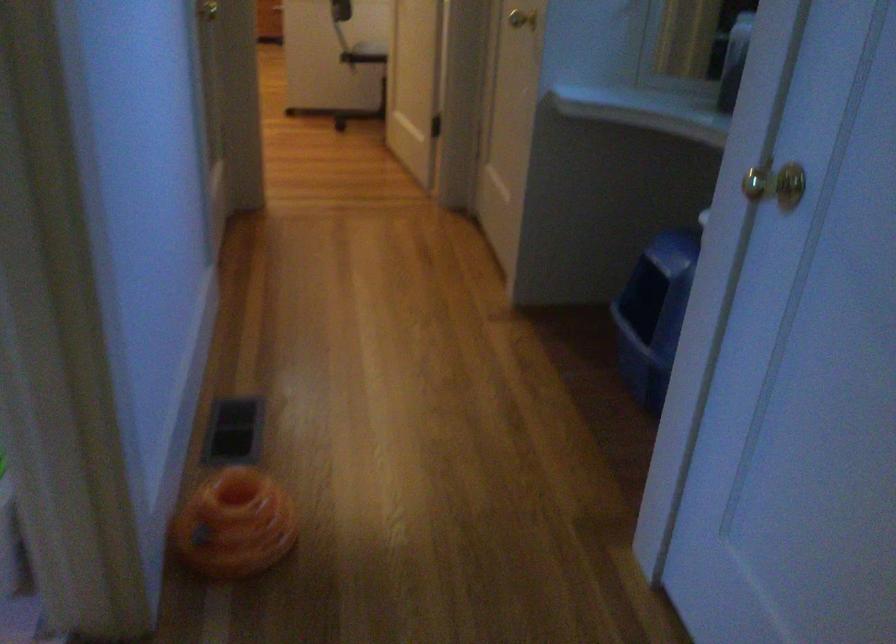
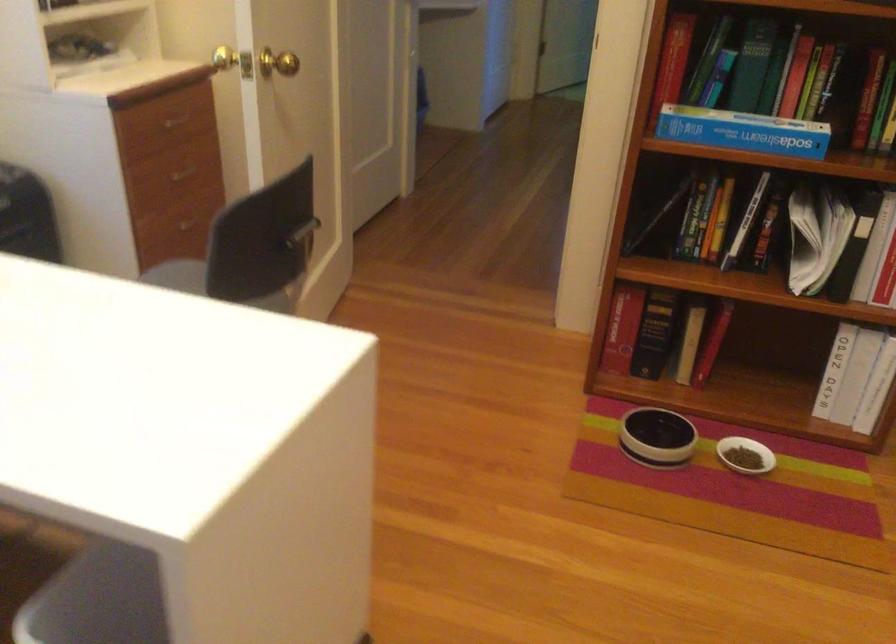
Question: I am providing you with two images of the same scene from different viewpoints. Which of the following objects are not visible in image2?

Choices:
 (A) toilet brush handle
 (B) black and white bowl
 (C) gold doorknob
 (D) brass door knob

Answer: (C)